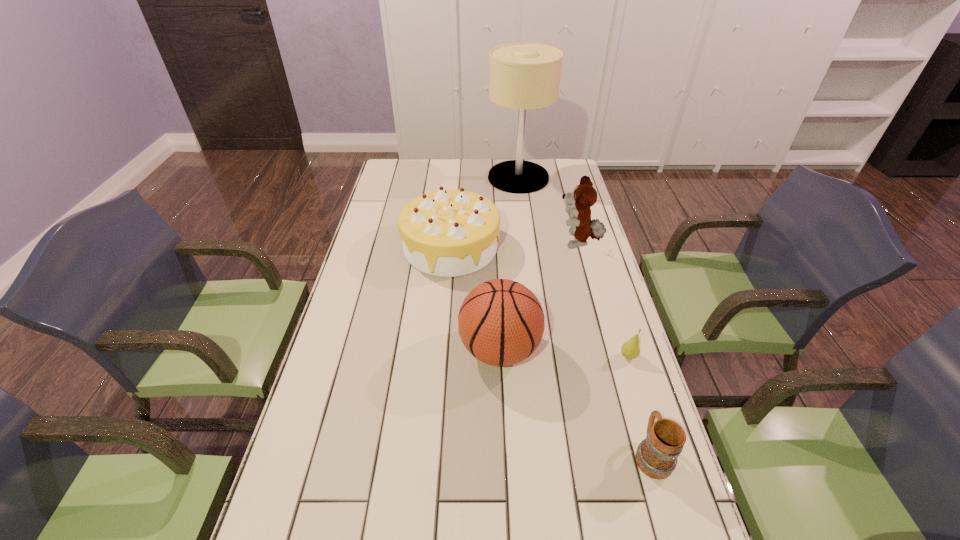
Identify the location of free point between the mug and the birthday cake. (551, 350).

The height and width of the screenshot is (540, 960). What are the coordinates of `free spot between the shortest object and the farthest object` in the screenshot? It's located at (573, 267).

Identify the location of vacant space in between the birthday cake and the puppy. The height and width of the screenshot is (540, 960). (515, 245).

The width and height of the screenshot is (960, 540). What are the coordinates of `unoccupied area between the pear and the fifth tallest object` in the screenshot? It's located at (640, 406).

Locate an element on the screen. Image resolution: width=960 pixels, height=540 pixels. vacant point located between the basketball and the nearest object is located at coordinates (576, 402).

I want to click on object that is the second closest one to the birthday cake, so click(x=522, y=76).

Where is `object that stands as the fourth closest to the basketball`? The height and width of the screenshot is (540, 960). object that stands as the fourth closest to the basketball is located at coordinates (584, 196).

Where is `free space in the image that satisfies the following two spatial constraints: 1. on the face of the puppy; 2. on the front side of the birthday cake`? free space in the image that satisfies the following two spatial constraints: 1. on the face of the puppy; 2. on the front side of the birthday cake is located at coordinates (579, 247).

Locate an element on the screen. Image resolution: width=960 pixels, height=540 pixels. free location that satisfies the following two spatial constraints: 1. on the side of the mug with the handle; 2. on the left side of the shortest object is located at coordinates (622, 356).

I want to click on free spot that satisfies the following two spatial constraints: 1. on the face of the shortest object; 2. on the left side of the puppy, so click(x=609, y=356).